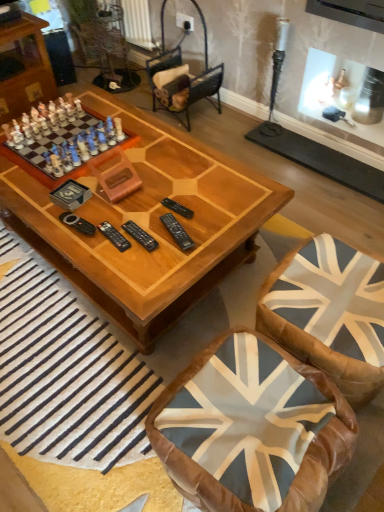
Describe the element at coordinates (140, 236) in the screenshot. I see `black plastic remote at center` at that location.

At what (x,y) coordinates should I click in order to perform the action: click on black plastic remote at center. Please return your answer as a coordinate pair (x, y). This screenshot has height=512, width=384. Looking at the image, I should click on (140, 236).

Locate an element on the screen. The height and width of the screenshot is (512, 384). leather union jack cushion at lower right is located at coordinates [x=251, y=428].

Locate an element on the screen. Image resolution: width=384 pixels, height=512 pixels. velvet brown armchair at center is located at coordinates (182, 83).

Does wooden coffee table at center have a lesser width compared to black plastic remote at center?

In fact, wooden coffee table at center might be wider than black plastic remote at center.

Is wooden coffee table at center oriented towards black plastic remote at center?

No, wooden coffee table at center is not turned towards black plastic remote at center.

From a real-world perspective, which object stands above the other?

In real-world perspective, black plastic remote at center is above.

Identify the location of remote lying on the right of wooden coffee table at center. This screenshot has height=512, width=384. (140, 236).

Does leather union jack cushion at lower right touch porcelain chess set at left?

There is a gap between leather union jack cushion at lower right and porcelain chess set at left.

Looking at this image, from the image's perspective, between leather union jack cushion at lower right and porcelain chess set at left, which one is located above?

porcelain chess set at left is shown above in the image.

How far apart are leather union jack cushion at lower right and porcelain chess set at left?

leather union jack cushion at lower right and porcelain chess set at left are 3.73 feet apart from each other.

Considering the relative positions of leather union jack cushion at lower right and porcelain chess set at left in the image provided, is leather union jack cushion at lower right to the left or to the right of porcelain chess set at left?

leather union jack cushion at lower right is to the right of porcelain chess set at left.

Does velvet brown armchair at center have a lesser width compared to black plastic remote at center?

In fact, velvet brown armchair at center might be wider than black plastic remote at center.

Does velvet brown armchair at center have a greater height compared to black plastic remote at center?

Correct, velvet brown armchair at center is much taller as black plastic remote at center.

Which of these two, velvet brown armchair at center or black plastic remote at center, is bigger?

velvet brown armchair at center.

How different are the orientations of velvet brown armchair at center and black plastic remote at center in degrees?

92.8 degrees separate the facing orientations of velvet brown armchair at center and black plastic remote at center.

From a real-world perspective, who is located higher, wooden coffee table at center or leather union jack cushion at lower right?

wooden coffee table at center is physically above.

Based on the photo, is wooden coffee table at center positioned with its back to leather union jack cushion at lower right?

wooden coffee table at center does not have its back to leather union jack cushion at lower right.

Is point (35, 189) positioned before point (326, 416)?

No.

Based on their sizes in the image, would you say porcelain chess set at left is bigger or smaller than leather union jack cushion at lower right?

porcelain chess set at left is smaller than leather union jack cushion at lower right.

Between porcelain chess set at left and leather union jack cushion at lower right, which one is positioned in front?

leather union jack cushion at lower right.

From the image's perspective, is porcelain chess set at left positioned above or below leather union jack cushion at lower right?

porcelain chess set at left is situated higher than leather union jack cushion at lower right in the image.

From a real-world perspective, relative to leather union jack cushion at lower right, is porcelain chess set at left vertically above or below?

From a real-world perspective, porcelain chess set at left is physically above leather union jack cushion at lower right.

Looking at their sizes, would you say wooden coffee table at center is wider or thinner than porcelain chess set at left?

In the image, wooden coffee table at center appears to be wider than porcelain chess set at left.

Considering the sizes of objects wooden coffee table at center and porcelain chess set at left in the image provided, who is shorter, wooden coffee table at center or porcelain chess set at left?

porcelain chess set at left is shorter.

At what (x,y) coordinates should I click in order to perform the action: click on coffee table on the right of porcelain chess set at left. Please return your answer as a coordinate pair (x, y). The image size is (384, 512). Looking at the image, I should click on (147, 222).

From a real-world perspective, between wooden coffee table at center and porcelain chess set at left, who is vertically lower?

wooden coffee table at center.

Measure the distance between velvet brown armchair at center and wooden coffee table at center.

velvet brown armchair at center and wooden coffee table at center are 3.73 feet apart.

Who is smaller, velvet brown armchair at center or wooden coffee table at center?

With smaller size is velvet brown armchair at center.

Is velvet brown armchair at center facing towards wooden coffee table at center?

No, velvet brown armchair at center is not turned towards wooden coffee table at center.

From the image's perspective, between velvet brown armchair at center and wooden coffee table at center, which one is located above?

velvet brown armchair at center.

What are the coordinates of `remote below the wooden coffee table at center (from the image's perspective)` in the screenshot? It's located at (140, 236).

Where is `chair below the porcelain chess set at left (from a real-world perspective)`? This screenshot has width=384, height=512. chair below the porcelain chess set at left (from a real-world perspective) is located at coordinates (251, 428).

Estimate the real-world distances between objects in this image. Which object is further from porcelain chess set at left, blue fabric swivel chair at lower right or wooden coffee table at center?

blue fabric swivel chair at lower right is positioned further to the anchor porcelain chess set at left.

Estimate the real-world distances between objects in this image. Which object is further from leather union jack cushion at lower right, black plastic remote at center or wooden coffee table at center?

black plastic remote at center lies further to leather union jack cushion at lower right than the other object.

In the scene shown: When comparing their distances from wooden coffee table at center, does porcelain chess set at left or blue fabric swivel chair at lower right seem further?

Based on the image, blue fabric swivel chair at lower right appears to be further to wooden coffee table at center.

Looking at the image, which one is located further to leather union jack cushion at lower right, black plastic remote at center or blue fabric swivel chair at lower right?

black plastic remote at center lies further to leather union jack cushion at lower right than the other object.

Which object lies nearer to the anchor point velvet brown armchair at center, black plastic remote at center or wooden coffee table at center?

wooden coffee table at center.

Considering their positions, is porcelain chess set at left positioned further to leather union jack cushion at lower right than blue fabric swivel chair at lower right?

porcelain chess set at left lies further to leather union jack cushion at lower right than the other object.

When comparing their distances from porcelain chess set at left, does wooden coffee table at center or black plastic remote at center seem closer?

wooden coffee table at center is positioned closer to the anchor porcelain chess set at left.

When comparing their distances from black plastic remote at center, does porcelain chess set at left or leather union jack cushion at lower right seem further?

The object further to black plastic remote at center is leather union jack cushion at lower right.

Locate an element on the screen. Image resolution: width=384 pixels, height=512 pixels. board game positioned between wooden coffee table at center and velvet brown armchair at center from near to far is located at coordinates (65, 145).

You are a GUI agent. You are given a task and a screenshot of the screen. Output one action in this format:
    pyautogui.click(x=<x>, y=<y>)
    Task: Click on the chair situated between black plastic remote at center and blue fabric swivel chair at lower right from left to right
    Image resolution: width=384 pixels, height=512 pixels.
    Given the screenshot: What is the action you would take?
    pyautogui.click(x=251, y=428)

At what (x,y) coordinates should I click in order to perform the action: click on coffee table located between blue fabric swivel chair at lower right and velvet brown armchair at center in the depth direction. Please return your answer as a coordinate pair (x, y). The height and width of the screenshot is (512, 384). Looking at the image, I should click on click(147, 222).

Locate an element on the screen. Image resolution: width=384 pixels, height=512 pixels. remote located between blue fabric swivel chair at lower right and velvet brown armchair at center in the depth direction is located at coordinates (140, 236).